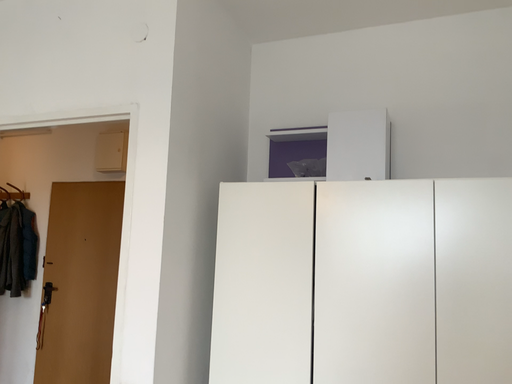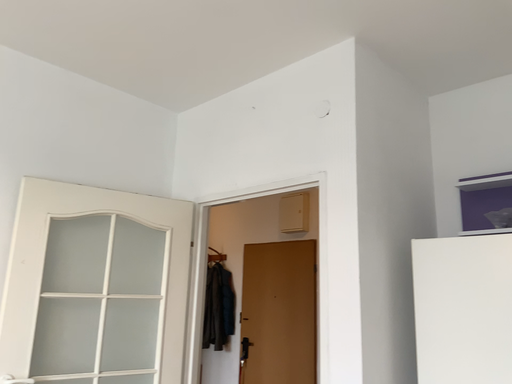
Question: How did the camera likely rotate when shooting the video?

Choices:
 (A) rotated downward
 (B) rotated upward

Answer: (B)